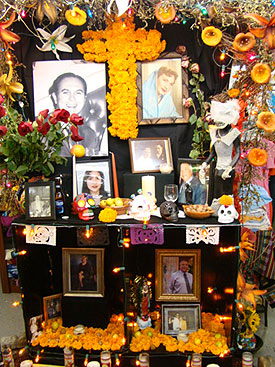
In order to click on orange lightbulb in this screenshot , I will do `click(115, 269)`.